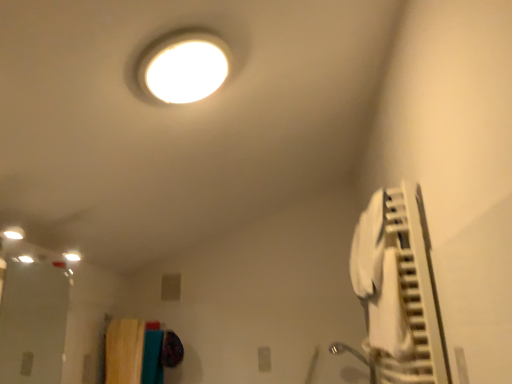
Question: From the image's perspective, is transparent glass door at lower left below textured fabric laundry at lower left?

Choices:
 (A) no
 (B) yes

Answer: (A)

Question: From the image's perspective, is transparent glass door at lower left above textured fabric laundry at lower left?

Choices:
 (A) yes
 (B) no

Answer: (A)

Question: Is transparent glass door at lower left not inside textured fabric laundry at lower left?

Choices:
 (A) yes
 (B) no

Answer: (A)

Question: Could you tell me if transparent glass door at lower left is turned towards textured fabric laundry at lower left?

Choices:
 (A) yes
 (B) no

Answer: (B)

Question: Does transparent glass door at lower left have a lesser height compared to textured fabric laundry at lower left?

Choices:
 (A) no
 (B) yes

Answer: (A)

Question: Is textured fabric laundry at lower left bigger or smaller than white fabric air conditioner at right?

Choices:
 (A) big
 (B) small

Answer: (B)

Question: From the image's perspective, is textured fabric laundry at lower left above or below white fabric air conditioner at right?

Choices:
 (A) below
 (B) above

Answer: (A)

Question: Considering the positions of point (174, 364) and point (394, 249), is point (174, 364) closer or farther from the camera than point (394, 249)?

Choices:
 (A) closer
 (B) farther

Answer: (B)

Question: Choose the correct answer: Is textured fabric laundry at lower left inside white fabric air conditioner at right or outside it?

Choices:
 (A) outside
 (B) inside

Answer: (A)

Question: Is white fabric air conditioner at right spatially inside transparent glass door at lower left, or outside of it?

Choices:
 (A) outside
 (B) inside

Answer: (A)

Question: From a real-world perspective, relative to transparent glass door at lower left, is white fabric air conditioner at right vertically above or below?

Choices:
 (A) above
 (B) below

Answer: (A)

Question: Is point (370, 296) positioned closer to the camera than point (39, 357)?

Choices:
 (A) closer
 (B) farther

Answer: (A)

Question: In terms of height, does white fabric air conditioner at right look taller or shorter compared to transparent glass door at lower left?

Choices:
 (A) short
 (B) tall

Answer: (B)

Question: Considering the positions of textured fabric laundry at lower left and transparent glass door at lower left in the image, is textured fabric laundry at lower left wider or thinner than transparent glass door at lower left?

Choices:
 (A) wide
 (B) thin

Answer: (A)

Question: From a real-world perspective, is textured fabric laundry at lower left above or below transparent glass door at lower left?

Choices:
 (A) above
 (B) below

Answer: (B)